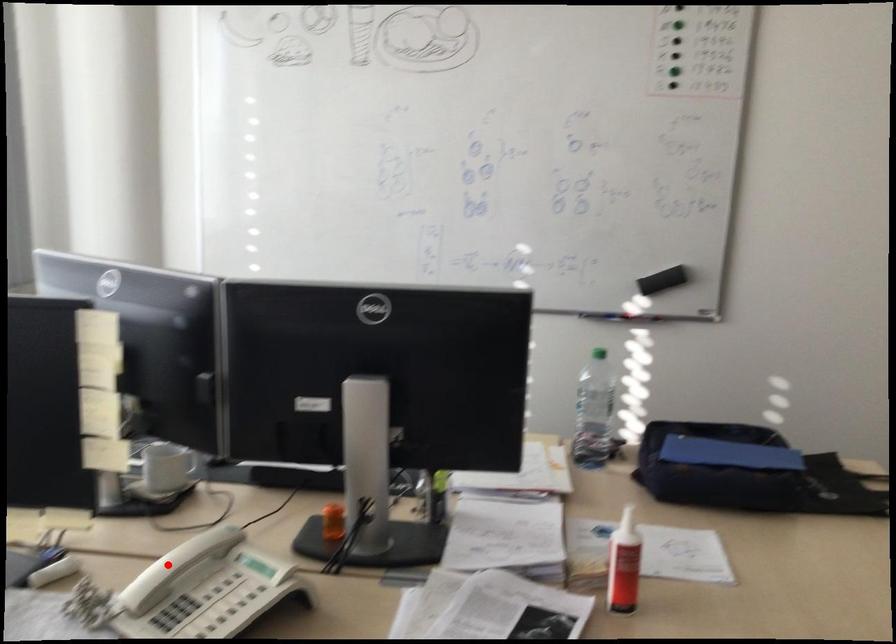
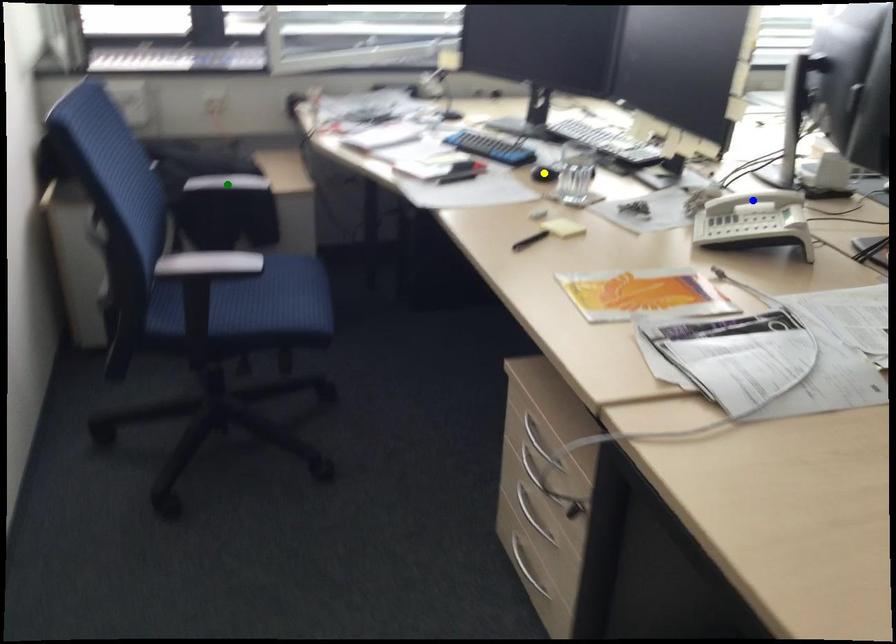
Question: I am providing you with two images of the same scene from different viewpoints. A red point is marked on the first image. You are given multiple points on the second image. Which point in image 2 represents the same 3d spot as the red point in image 1?

Choices:
 (A) blue point
 (B) green point
 (C) yellow point

Answer: (A)